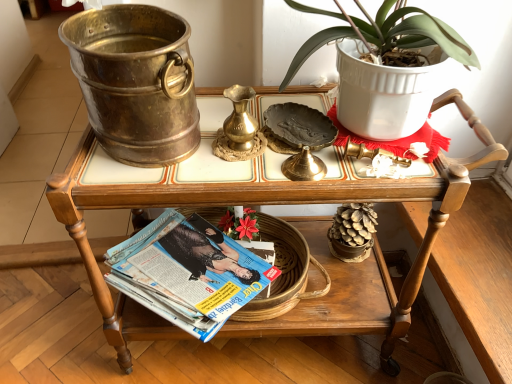
Where is `wooden serving cart at center`? Image resolution: width=512 pixels, height=384 pixels. wooden serving cart at center is located at coordinates [x=186, y=203].

This screenshot has width=512, height=384. What do you see at coordinates (186, 203) in the screenshot?
I see `wooden serving cart at center` at bounding box center [186, 203].

What do you see at coordinates (187, 272) in the screenshot? The width and height of the screenshot is (512, 384). I see `matte paper magazine at lower center` at bounding box center [187, 272].

You are a GUI agent. You are given a task and a screenshot of the screen. Output one action in this format:
    pyautogui.click(x=<x>, y=<y>)
    Task: Click on the matte paper magazine at lower center
    The width and height of the screenshot is (512, 384).
    Given the screenshot: What is the action you would take?
    pyautogui.click(x=187, y=272)

Identify the location of wooden serving cart at center. (186, 203).

Based on their positions, is matte paper magazine at lower center located to the left or right of wooden serving cart at center?

matte paper magazine at lower center is to the left of wooden serving cart at center.

Is matte paper magazine at lower center in front of wooden serving cart at center?

No, it is not.

Is point (199, 239) behind point (138, 330)?

Yes.

From the image's perspective, would you say matte paper magazine at lower center is shown under wooden serving cart at center?

Yes.

From a real-world perspective, does matte paper magazine at lower center stand above wooden serving cart at center?

Incorrect, from a real-world perspective, matte paper magazine at lower center is lower than wooden serving cart at center.

Between matte paper magazine at lower center and wooden serving cart at center, which one has larger width?

wooden serving cart at center.

Considering the relative sizes of matte paper magazine at lower center and wooden serving cart at center in the image provided, is matte paper magazine at lower center shorter than wooden serving cart at center?

Correct, matte paper magazine at lower center is not as tall as wooden serving cart at center.

Looking at this image, is matte paper magazine at lower center smaller than wooden serving cart at center?

Indeed, matte paper magazine at lower center has a smaller size compared to wooden serving cart at center.

Can we say matte paper magazine at lower center lies outside wooden serving cart at center?

No, matte paper magazine at lower center is not outside of wooden serving cart at center.

Is matte paper magazine at lower center not close to wooden serving cart at center?

No, matte paper magazine at lower center is in close proximity to wooden serving cart at center.

Is matte paper magazine at lower center oriented away from wooden serving cart at center?

Absolutely, matte paper magazine at lower center is directed away from wooden serving cart at center.

The image size is (512, 384). I want to click on table above the matte paper magazine at lower center (from the image's perspective), so click(186, 203).

Considering the positions of objects wooden serving cart at center and matte paper magazine at lower center in the image provided, who is more to the right, wooden serving cart at center or matte paper magazine at lower center?

wooden serving cart at center is more to the right.

Relative to matte paper magazine at lower center, is wooden serving cart at center in front or behind?

Clearly, wooden serving cart at center is in front of matte paper magazine at lower center.

Considering the positions of point (116, 344) and point (189, 286), is point (116, 344) closer or farther from the camera than point (189, 286)?

Clearly, point (116, 344) is more distant from the camera than point (189, 286).

From the image's perspective, is wooden serving cart at center located beneath matte paper magazine at lower center?

No, from the image's perspective, wooden serving cart at center is not below matte paper magazine at lower center.

From a real-world perspective, is wooden serving cart at center over matte paper magazine at lower center?

Yes.

Consider the image. Considering the sizes of objects wooden serving cart at center and matte paper magazine at lower center in the image provided, who is wider, wooden serving cart at center or matte paper magazine at lower center?

Wider between the two is wooden serving cart at center.

Does wooden serving cart at center have a greater height compared to matte paper magazine at lower center?

Yes.

Which of these two, wooden serving cart at center or matte paper magazine at lower center, is smaller?

Smaller between the two is matte paper magazine at lower center.

Is matte paper magazine at lower center inside wooden serving cart at center?

Yes, matte paper magazine at lower center can be found within wooden serving cart at center.

Would you say wooden serving cart at center is a long distance from matte paper magazine at lower center?

No, wooden serving cart at center is in close proximity to matte paper magazine at lower center.

Is wooden serving cart at center looking in the opposite direction of matte paper magazine at lower center?

Yes, matte paper magazine at lower center is at the back of wooden serving cart at center.

You are a GUI agent. You are given a task and a screenshot of the screen. Output one action in this format:
    pyautogui.click(x=<x>, y=<y>)
    Task: Click on the magazine below the wooden serving cart at center (from a real-world perspective)
    The width and height of the screenshot is (512, 384).
    Given the screenshot: What is the action you would take?
    [187, 272]

Identify the location of table above the matte paper magazine at lower center (from a real-world perspective). (186, 203).

At what (x,y) coordinates should I click in order to perform the action: click on table in front of the matte paper magazine at lower center. Please return your answer as a coordinate pair (x, y). This screenshot has height=384, width=512. Looking at the image, I should click on (186, 203).